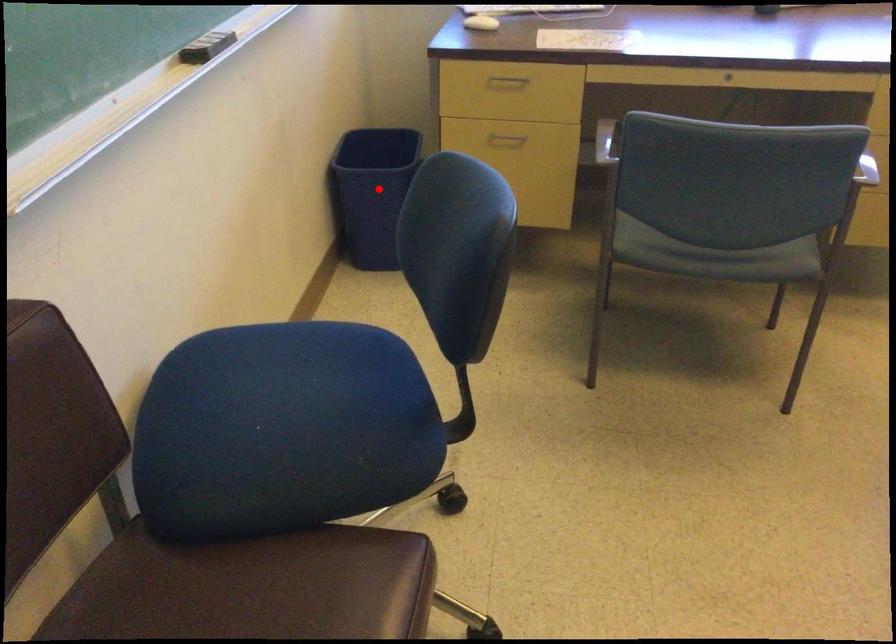
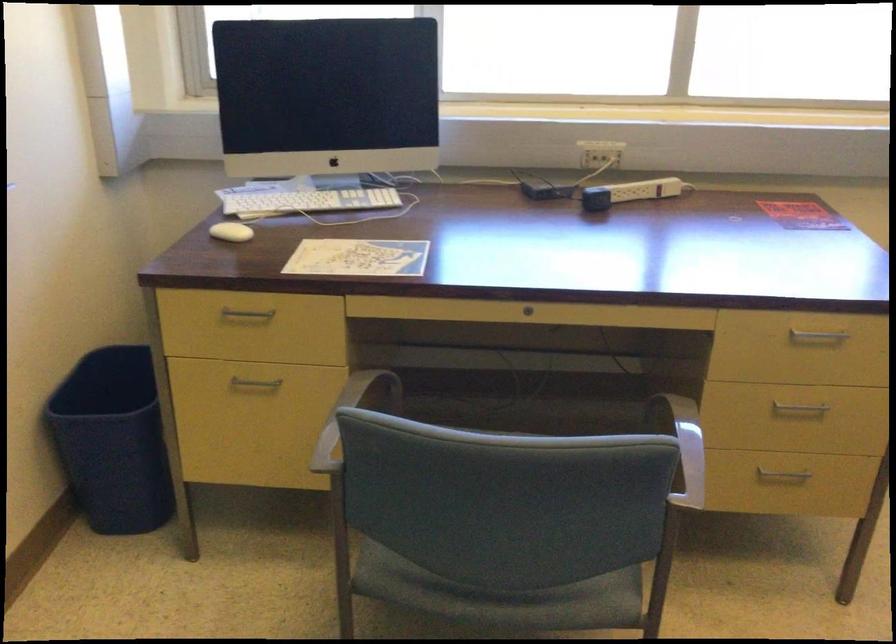
Locate, in the second image, the point that corresponds to the highlighted location in the first image.

(113, 440)